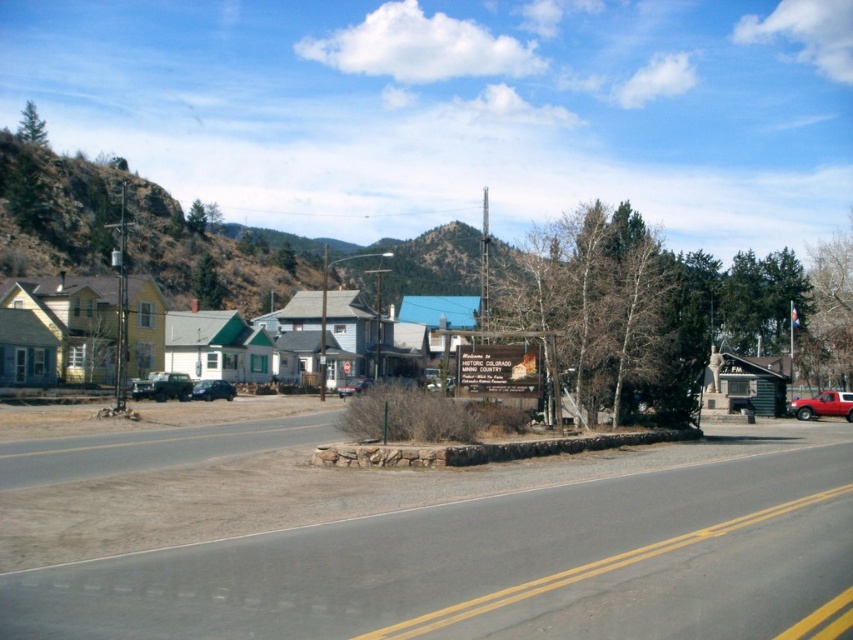
You are a delivery driver approaching the town and see the yellow wood houses at center and the red matte truck at right. Which object is wider?

The yellow wood houses at center are wider than the red matte truck at right because the yellow wood houses at center has a greater width compared to the red matte truck at right.

You are a delivery driver who needs to park your metallic silver car at center in a spot that can accommodate its size. There is also a metallic silver sedan at center already parked there. Can your car fit in the same spot without overlapping the sedan?

The metallic silver car at center is bigger than the metallic silver sedan at center. Therefore, the metallic silver car at center may not fit in the same parking spot as the metallic silver sedan at center without overlapping, since it is larger in size.

You are a delivery driver approaching the town and need to park your red matte truck at right near the yellow wood houses at center. Considering their sizes, will the truck fit in the space between the houses?

The yellow wood houses at center is bigger than red matte truck at right, so the truck should fit in the space between them as it is smaller in size.